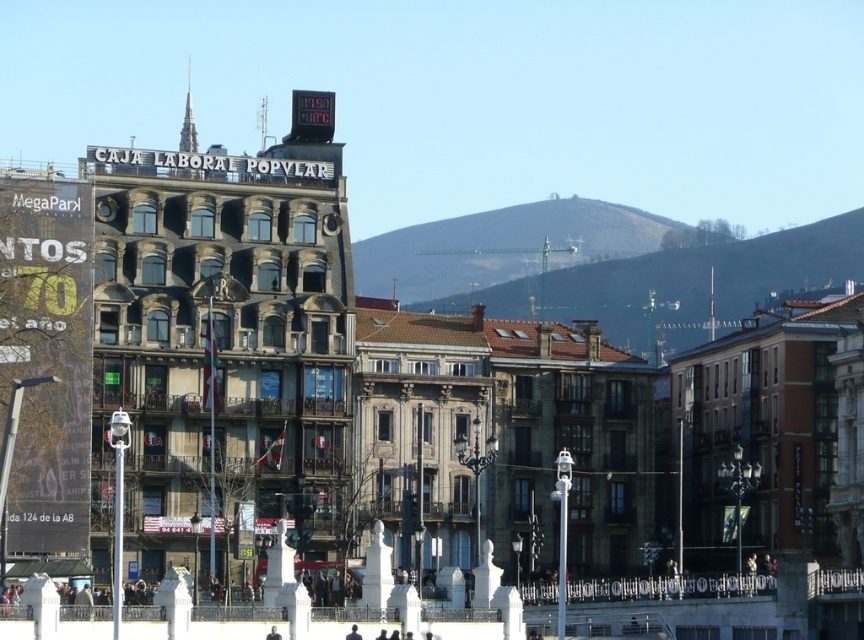
Question: In this image, where is metallic digital clock at center located relative to dark blue suit at center?

Choices:
 (A) below
 (B) above

Answer: (B)

Question: Does metallic digital clock at center have a larger size compared to dark blue suit at center?

Choices:
 (A) no
 (B) yes

Answer: (B)

Question: Estimate the real-world distances between objects in this image. Which object is farther from the metallic digital clock at center?

Choices:
 (A) dark blue suit at center
 (B) dark brown leather jacket at center

Answer: (B)

Question: Which point is closer to the camera?

Choices:
 (A) (322, 221)
 (B) (277, 632)
 (C) (356, 632)

Answer: (B)

Question: Which of the following is the closest to the observer?

Choices:
 (A) (354, 634)
 (B) (277, 634)

Answer: (B)

Question: Is metallic digital clock at center further to the viewer compared to dark brown leather jacket at center?

Choices:
 (A) yes
 (B) no

Answer: (A)